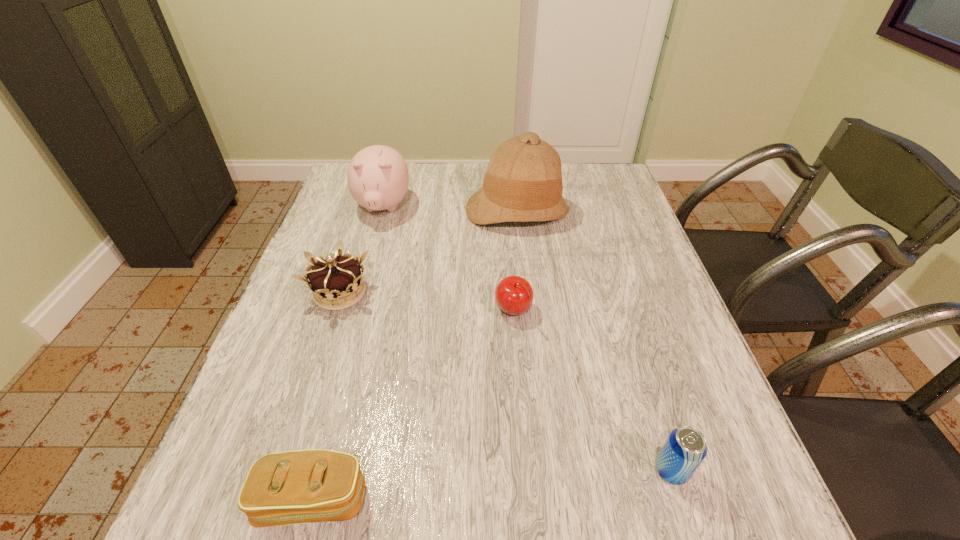
The image size is (960, 540). I want to click on vacant space located on the left of the rightmost object, so click(460, 470).

Where is `hat that is at the far edge`? This screenshot has height=540, width=960. hat that is at the far edge is located at coordinates (523, 183).

The image size is (960, 540). What are the coordinates of `piggy bank present at the far edge` in the screenshot? It's located at (378, 177).

At what (x,y) coordinates should I click in order to perform the action: click on beer can located at the near edge. Please return your answer as a coordinate pair (x, y). Looking at the image, I should click on (685, 448).

At what (x,y) coordinates should I click in order to perform the action: click on clutch bag located in the near edge section of the desktop. Please return your answer as a coordinate pair (x, y). The width and height of the screenshot is (960, 540). Looking at the image, I should click on (292, 487).

At what (x,y) coordinates should I click in order to perform the action: click on piggy bank that is at the left edge. Please return your answer as a coordinate pair (x, y). Looking at the image, I should click on (378, 177).

In order to click on crown at the left edge in this screenshot , I will do `click(336, 276)`.

You are a GUI agent. You are given a task and a screenshot of the screen. Output one action in this format:
    pyautogui.click(x=<x>, y=<y>)
    Task: Click on the clutch bag that is positioned at the left edge
    The height and width of the screenshot is (540, 960).
    Given the screenshot: What is the action you would take?
    pyautogui.click(x=292, y=487)

Where is `object situated at the right edge`? object situated at the right edge is located at coordinates (685, 448).

Find the location of a particular element. This screenshot has height=540, width=960. object present at the far left corner is located at coordinates tap(378, 177).